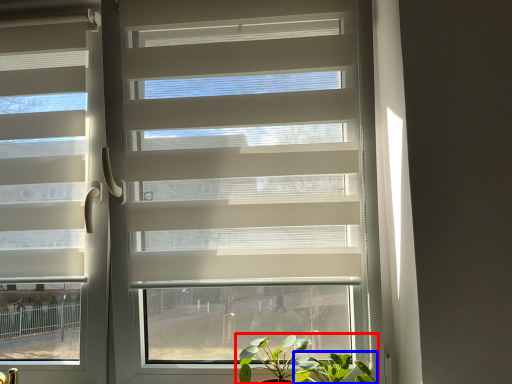
Question: Which of the following is the farthest to the observer, houseplant (highlighted by a red box) or vegetation (highlighted by a blue box)?

Choices:
 (A) houseplant
 (B) vegetation

Answer: (A)